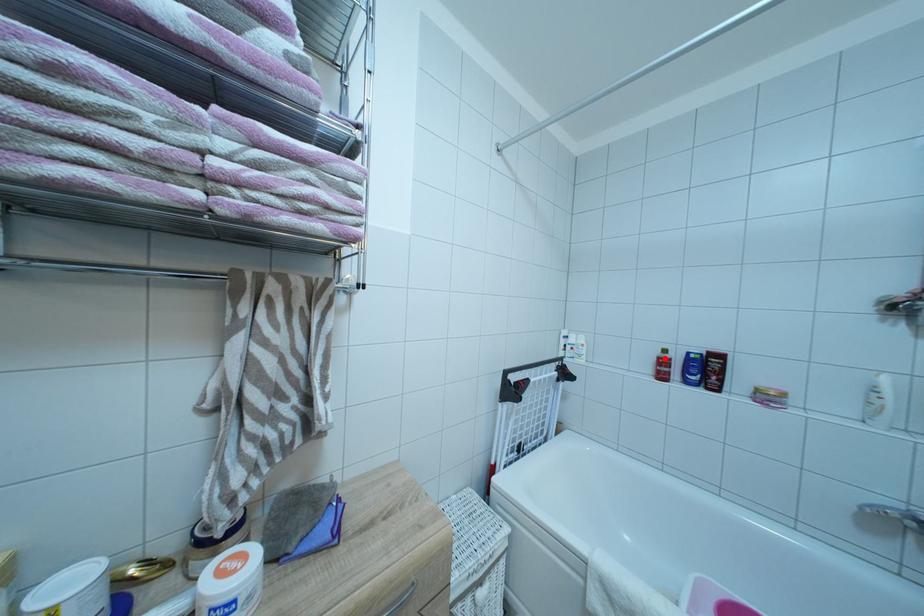
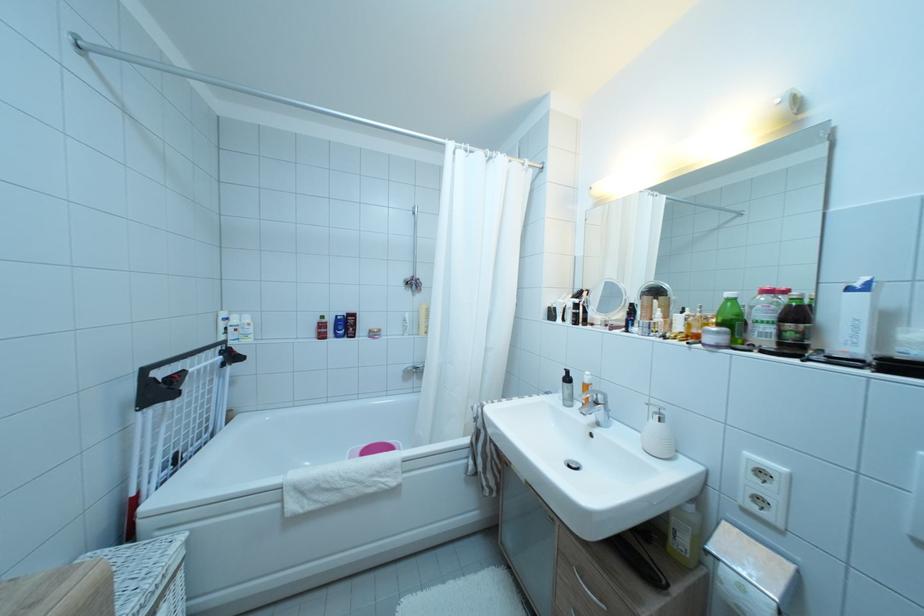
Find the pixel in the second image that matches the highlighted location in the first image.

(324, 325)